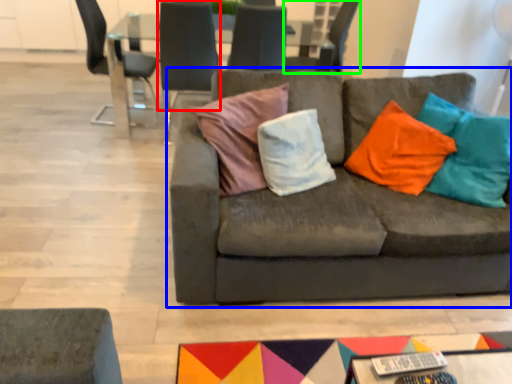
Question: Which is farther away from chair (highlighted by a red box)? studio couch (highlighted by a blue box) or chair (highlighted by a green box)?

Choices:
 (A) studio couch
 (B) chair

Answer: (A)